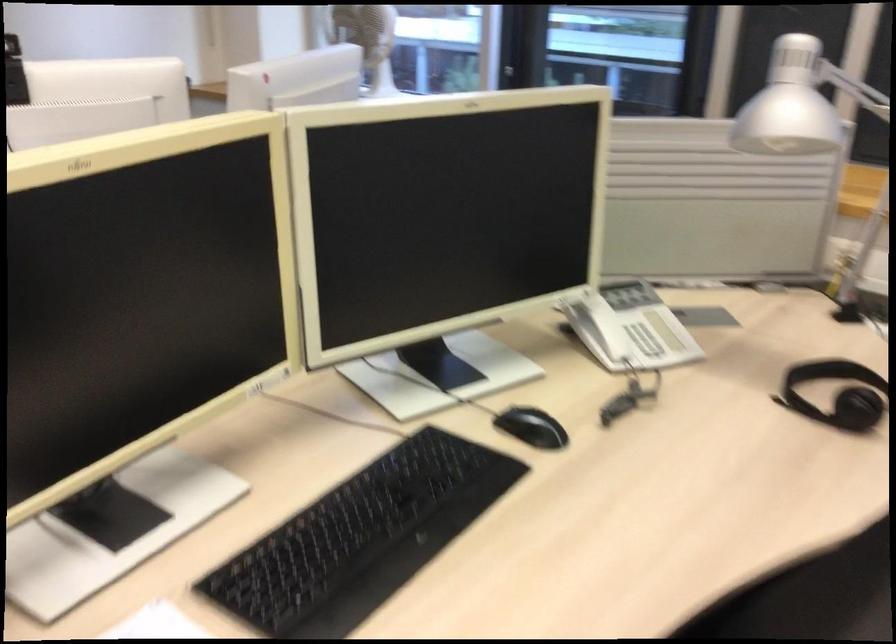
Where is `silver lamp head`? This screenshot has height=644, width=896. silver lamp head is located at coordinates (788, 105).